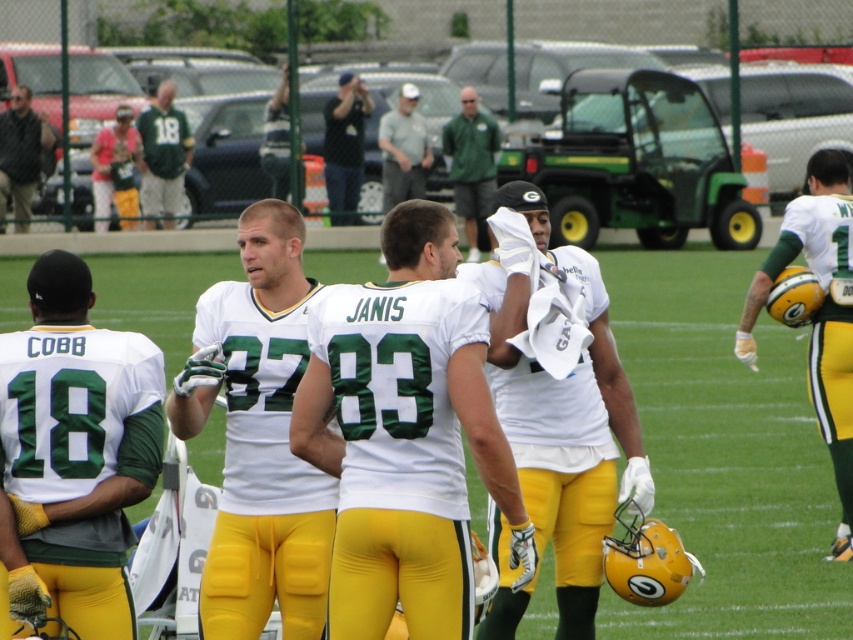
Does point (339, 636) lie in front of point (119, 634)?

Yes, point (339, 636) is closer to viewer.

Is point (463, 385) behind point (9, 385)?

No, it is in front of (9, 385).

Is point (409, 273) farther from camera compared to point (27, 406)?

Yes.

Where is `white jersey at center`? white jersey at center is located at coordinates (404, 433).

Can you confirm if white jersey at center is thinner than matte green jersey at upper left?

No.

Which is above, white jersey at center or matte green jersey at upper left?

matte green jersey at upper left is above.

Is point (311, 460) more distant than point (163, 192)?

No.

Where is `white jersey at center`? The height and width of the screenshot is (640, 853). white jersey at center is located at coordinates (404, 433).

Between point (349, 442) and point (606, 488), which one is positioned in front?

Point (349, 442) is more forward.

The image size is (853, 640). Describe the element at coordinates (404, 433) in the screenshot. I see `white jersey at center` at that location.

Between point (376, 460) and point (581, 490), which one is positioned in front?

Point (376, 460) is in front.

Find the location of a particular element. white jersey at center is located at coordinates (404, 433).